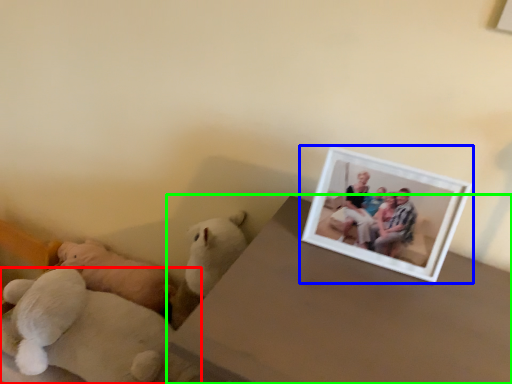
Question: Which is nearer to the teddy bear (highlighted by a red box)? picture frame (highlighted by a blue box) or table (highlighted by a green box).

Choices:
 (A) picture frame
 (B) table

Answer: (B)